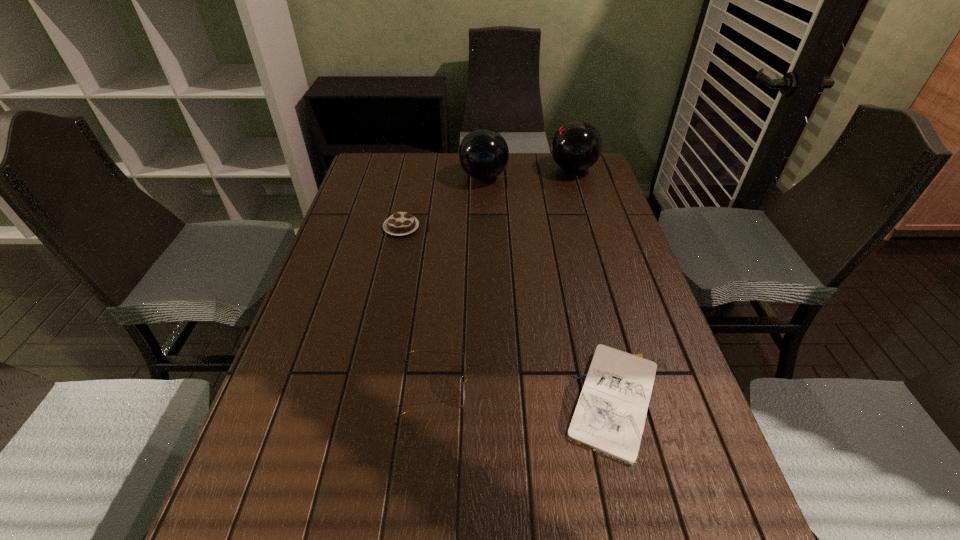
You are a GUI agent. You are given a task and a screenshot of the screen. Output one action in this format:
    pyautogui.click(x=<x>, y=<y>)
    Task: Click on the free space at the left edge
    This screenshot has height=540, width=960.
    Given the screenshot: What is the action you would take?
    pyautogui.click(x=360, y=339)

Where is `vacant space at the right edge of the desktop`? The image size is (960, 540). vacant space at the right edge of the desktop is located at coordinates (612, 294).

You are a GUI agent. You are given a task and a screenshot of the screen. Output one action in this format:
    pyautogui.click(x=<x>, y=<y>)
    Task: Click on the vacant space at the far left corner
    
    Given the screenshot: What is the action you would take?
    pyautogui.click(x=370, y=165)

The image size is (960, 540). Find the location of `vacant area that lies between the third nearest object and the right bowling ball`. vacant area that lies between the third nearest object and the right bowling ball is located at coordinates (487, 198).

The width and height of the screenshot is (960, 540). Find the location of `free area in between the right bowling ball and the third farthest object`. free area in between the right bowling ball and the third farthest object is located at coordinates (487, 198).

The image size is (960, 540). Identify the location of vacant space that's between the right bowling ball and the third farthest object. (487, 198).

The width and height of the screenshot is (960, 540). I want to click on free space between the left bowling ball and the shortest object, so click(549, 289).

Where is `empty space that is in between the left bowling ball and the third shortest object`? This screenshot has width=960, height=540. empty space that is in between the left bowling ball and the third shortest object is located at coordinates (460, 282).

Find the location of a particular element. Image resolution: width=960 pixels, height=540 pixels. empty location between the spectacles and the left bowling ball is located at coordinates (460, 282).

Identify the location of free space that is in between the notebook and the third farthest object. The height and width of the screenshot is (540, 960). (508, 315).